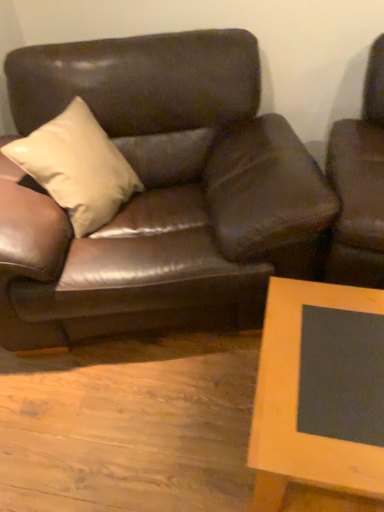
What do you see at coordinates (319, 391) in the screenshot? I see `wooden frame at lower right` at bounding box center [319, 391].

What are the coordinates of `wooden frame at lower right` in the screenshot? It's located at (319, 391).

Consider the image. What is the approximate width of matte brown leather couch at center?

It is 3.29 feet.

This screenshot has height=512, width=384. What do you see at coordinates (159, 193) in the screenshot? I see `matte brown leather couch at center` at bounding box center [159, 193].

I want to click on matte brown leather couch at center, so click(x=159, y=193).

What is the approximate height of matte brown leather couch at center?

matte brown leather couch at center is 38.52 inches tall.

Locate an element on the screen. This screenshot has height=512, width=384. wooden frame at lower right is located at coordinates (319, 391).

Does matte brown leather couch at center appear on the right side of wooden frame at lower right?

No, matte brown leather couch at center is not to the right of wooden frame at lower right.

Is matte brown leather couch at center behind wooden frame at lower right?

Yes, matte brown leather couch at center is further from the viewer.

Which point is more distant from viewer, [111,252] or [316,408]?

The point [111,252] is farther from the camera.

From the image's perspective, would you say matte brown leather couch at center is shown under wooden frame at lower right?

No, from the image's perspective, matte brown leather couch at center is not below wooden frame at lower right.

From a real-world perspective, which object stands above the other?

From a 3D spatial view, matte brown leather couch at center is above.

Based on the photo, which object is wider, matte brown leather couch at center or wooden frame at lower right?

With larger width is matte brown leather couch at center.

Is matte brown leather couch at center taller or shorter than wooden frame at lower right?

Clearly, matte brown leather couch at center is taller compared to wooden frame at lower right.

Can you confirm if matte brown leather couch at center is smaller than wooden frame at lower right?

Actually, matte brown leather couch at center might be larger than wooden frame at lower right.

Does matte brown leather couch at center contain wooden frame at lower right?

Actually, wooden frame at lower right is outside matte brown leather couch at center.

Are matte brown leather couch at center and wooden frame at lower right making contact?

No, matte brown leather couch at center is not beside wooden frame at lower right.

Is matte brown leather couch at center turned away from wooden frame at lower right?

That's not correct — matte brown leather couch at center is not looking away from wooden frame at lower right.

How different are the orientations of matte brown leather couch at center and wooden frame at lower right in degrees?

The facing directions of matte brown leather couch at center and wooden frame at lower right are 17.5 degrees apart.

At what (x,y) coordinates should I click in order to perform the action: click on table that appears in front of the matte brown leather couch at center. Please return your answer as a coordinate pair (x, y). The width and height of the screenshot is (384, 512). Looking at the image, I should click on (319, 391).

Between wooden frame at lower right and matte brown leather couch at center, which one appears on the right side from the viewer's perspective?

wooden frame at lower right.

Is wooden frame at lower right further to the viewer compared to matte brown leather couch at center?

No, the depth of wooden frame at lower right is less than that of matte brown leather couch at center.

Is point (357, 340) closer or farther from the camera than point (63, 44)?

Point (357, 340) is closer to the camera than point (63, 44).

From the image's perspective, is wooden frame at lower right on matte brown leather couch at center?

No.

From a real-world perspective, which object stands above the other?

In real-world perspective, matte brown leather couch at center is above.

Considering the sizes of objects wooden frame at lower right and matte brown leather couch at center in the image provided, who is wider, wooden frame at lower right or matte brown leather couch at center?

Wider between the two is matte brown leather couch at center.

Consider the image. Between wooden frame at lower right and matte brown leather couch at center, which one has more height?

matte brown leather couch at center.

Considering the sizes of objects wooden frame at lower right and matte brown leather couch at center in the image provided, who is bigger, wooden frame at lower right or matte brown leather couch at center?

With larger size is matte brown leather couch at center.

Can matte brown leather couch at center be found inside wooden frame at lower right?

No, matte brown leather couch at center is not a part of wooden frame at lower right.

Is wooden frame at lower right far from matte brown leather couch at center?

They are positioned close to each other.

From the picture: Is wooden frame at lower right aimed at matte brown leather couch at center?

No, wooden frame at lower right is not oriented towards matte brown leather couch at center.

The image size is (384, 512). I want to click on studio couch on the left of wooden frame at lower right, so click(x=159, y=193).

The image size is (384, 512). I want to click on table that appears in front of the matte brown leather couch at center, so click(x=319, y=391).

Locate an element on the screen. Image resolution: width=384 pixels, height=512 pixels. table below the matte brown leather couch at center (from the image's perspective) is located at coordinates pyautogui.click(x=319, y=391).